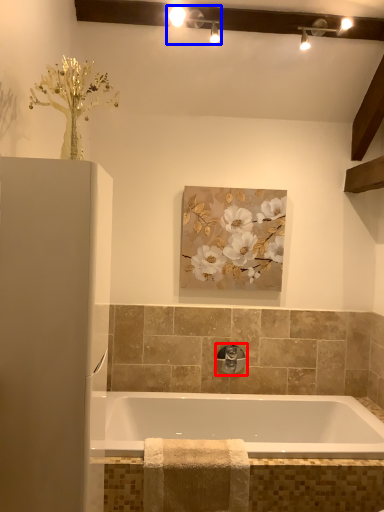
Question: Among these objects, which one is farthest to the camera, tap (highlighted by a red box) or light fixture (highlighted by a blue box)?

Choices:
 (A) tap
 (B) light fixture

Answer: (A)